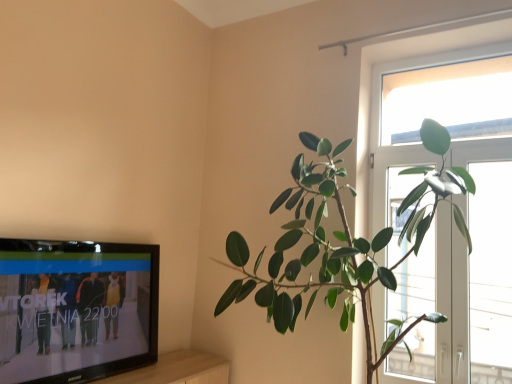
Question: Is the position of transparent glass window at upper right less distant than that of transparent glass window at upper right, the 1th window from the left?

Choices:
 (A) no
 (B) yes

Answer: (A)

Question: From the image's perspective, is transparent glass window at upper right on top of transparent glass window at upper right, arranged as the 2th window when viewed from the right?

Choices:
 (A) yes
 (B) no

Answer: (A)

Question: From a real-world perspective, is transparent glass window at upper right over transparent glass window at upper right, the 1th window from the left?

Choices:
 (A) yes
 (B) no

Answer: (A)

Question: Is transparent glass window at upper right, arranged as the 2th window when viewed from the right, inside transparent glass window at upper right?

Choices:
 (A) no
 (B) yes

Answer: (A)

Question: Would you consider transparent glass window at upper right to be distant from transparent glass window at upper right, the 1th window from the left?

Choices:
 (A) yes
 (B) no

Answer: (B)

Question: Considering the positions of point (496, 304) and point (308, 304), is point (496, 304) closer or farther from the camera than point (308, 304)?

Choices:
 (A) closer
 (B) farther

Answer: (A)

Question: Considering the positions of transparent glass window at right, arranged as the second window when viewed from the left, and green glossy plant at right in the image, is transparent glass window at right, arranged as the second window when viewed from the left, bigger or smaller than green glossy plant at right?

Choices:
 (A) big
 (B) small

Answer: (B)

Question: From a real-world perspective, relative to green glossy plant at right, is transparent glass window at right, the first window from the right, vertically above or below?

Choices:
 (A) below
 (B) above

Answer: (B)

Question: In the image, is transparent glass window at right, the first window from the right, on the left side or the right side of green glossy plant at right?

Choices:
 (A) right
 (B) left

Answer: (A)

Question: Is point (434, 205) positioned closer to the camera than point (499, 340)?

Choices:
 (A) closer
 (B) farther

Answer: (A)

Question: From the image's perspective, is green glossy plant at right located above or below transparent glass window at right, the first window from the right?

Choices:
 (A) above
 (B) below

Answer: (A)

Question: Based on their positions, is green glossy plant at right located to the left or right of transparent glass window at right, arranged as the second window when viewed from the left?

Choices:
 (A) left
 (B) right

Answer: (A)

Question: Is green glossy plant at right wider or thinner than transparent glass window at right, arranged as the second window when viewed from the left?

Choices:
 (A) thin
 (B) wide

Answer: (B)

Question: Is point (500, 251) closer or farther from the camera than point (459, 99)?

Choices:
 (A) farther
 (B) closer

Answer: (B)

Question: Considering the positions of transparent glass window at right, the first window from the right, and transparent glass window at upper right in the image, is transparent glass window at right, the first window from the right, taller or shorter than transparent glass window at upper right?

Choices:
 (A) short
 (B) tall

Answer: (B)